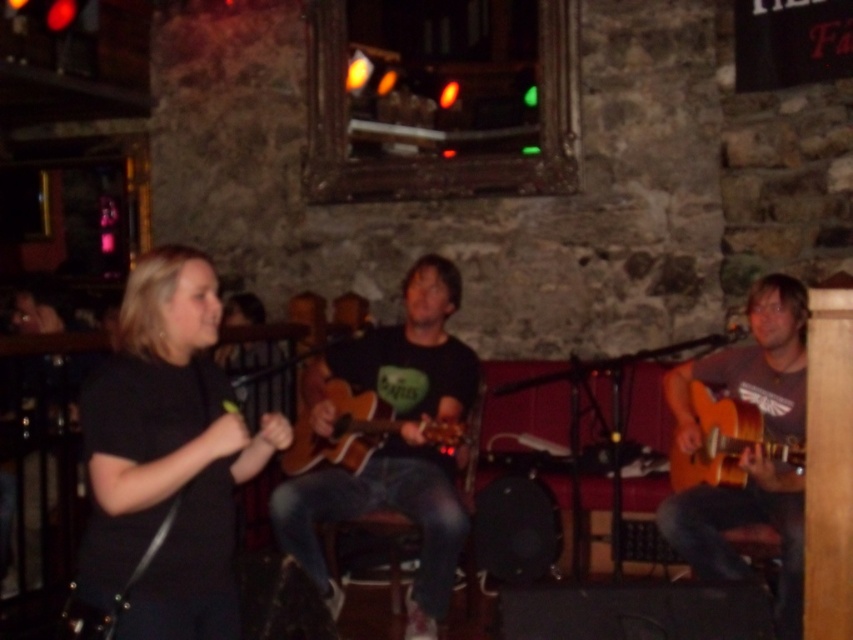
Question: In this image, where is black matte shirt at left located relative to light brown wooden guitar at center?

Choices:
 (A) right
 (B) left

Answer: (B)

Question: Which of the following is the closest to the observer?

Choices:
 (A) (461, 433)
 (B) (407, 388)
 (C) (238, 442)

Answer: (C)

Question: Is black matte shirt at left behind light brown wooden guitar at center?

Choices:
 (A) no
 (B) yes

Answer: (A)

Question: Can you confirm if black matte shirt at left is positioned to the left of matte black guitar at center?

Choices:
 (A) yes
 (B) no

Answer: (A)

Question: Which point is farther from the camera taking this photo?

Choices:
 (A) (706, 396)
 (B) (294, 429)
 (C) (90, 538)
 (D) (727, 388)

Answer: (B)

Question: Among these points, which one is farthest from the camera?

Choices:
 (A) (202, 534)
 (B) (453, 310)

Answer: (B)